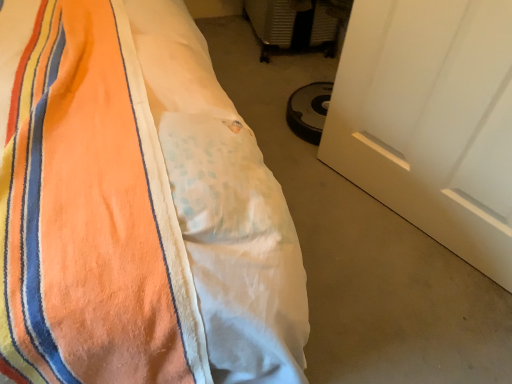
Find the location of `vacant area situated below white matte door at lower right (from a real-world perspective)`. vacant area situated below white matte door at lower right (from a real-world perspective) is located at coordinates (407, 223).